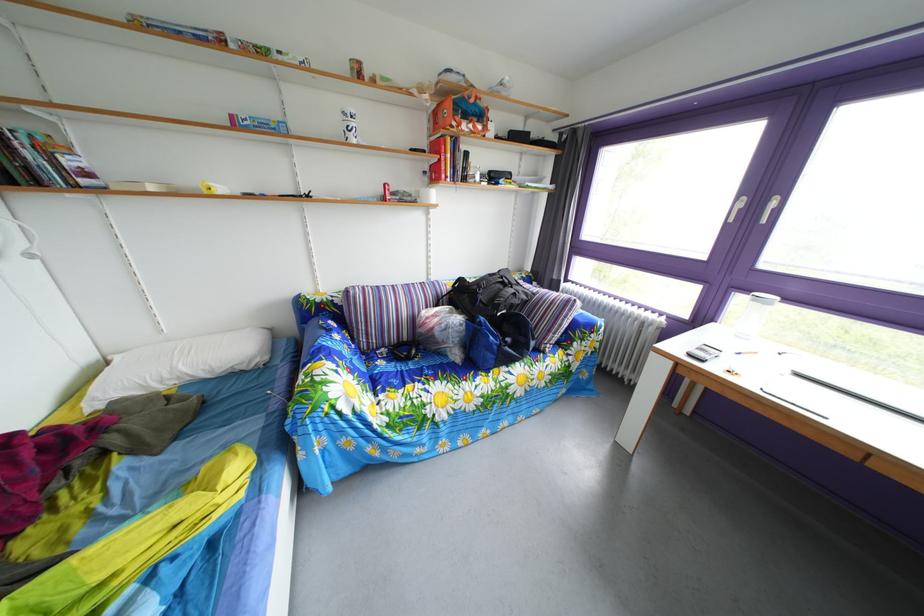
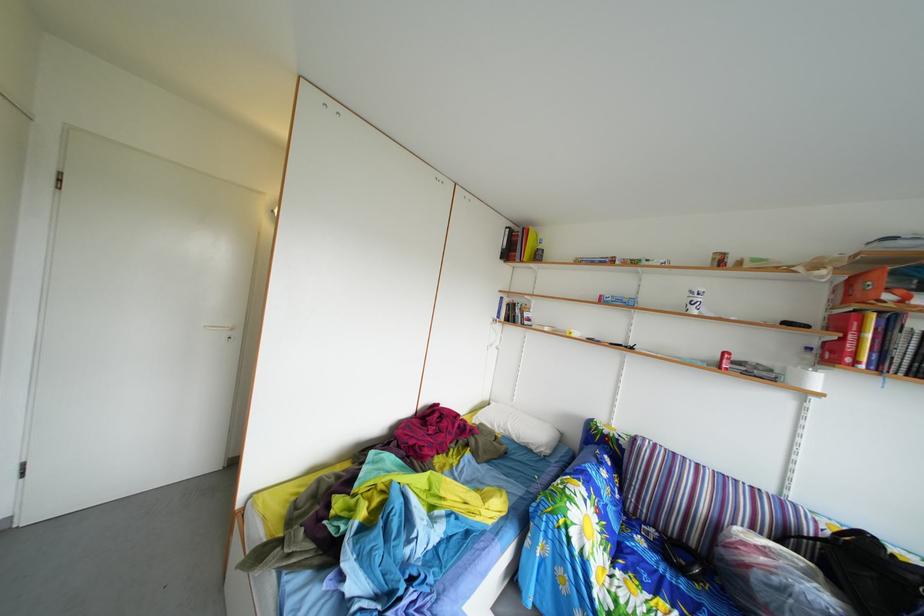
Question: The camera is either moving clockwise (left) or counter-clockwise (right) around the object. The first image is from the beginning of the video and the second image is from the end. Is the camera moving left or right when shooting the video?

Choices:
 (A) Left
 (B) Right

Answer: (B)